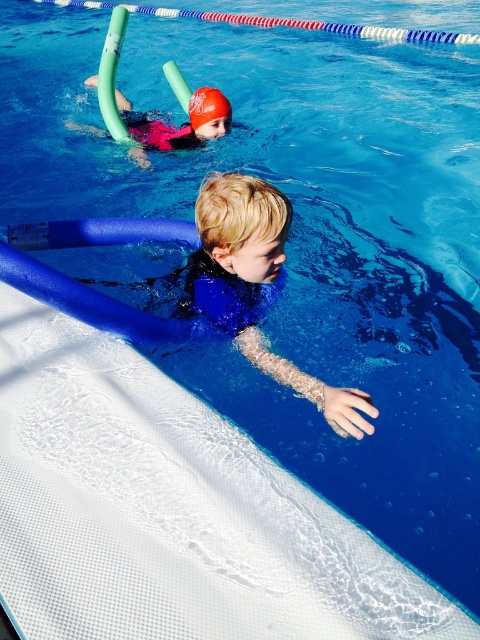
You are a lifeguard observing the pool area. You notice the blue rubber vest at lower center and the pink matte life jacket at upper center. Which one is nearer to you?

The blue rubber vest at lower center is closer to the viewer than the pink matte life jacket at upper center.

You are a lifeguard trying to locate the matte pink swim cap at upper center. According to the coordinates provided, where exactly is the matte pink swim cap positioned in the image?

The matte pink swim cap at upper center is located at point coordinates 0.198 on the x axis and 0.375 on the y axis.

You are a lifeguard standing at the edge of the pool. You notice two objects at the upper center of the pool area. The objects are the matte pink swim cap at upper center and the pink matte life jacket at upper center. Can you safely retrieve both items without getting into the water using a 2.5 inch long pool skimmer net?

The distance between the matte pink swim cap at upper center and the pink matte life jacket at upper center is 2.19 inches. Since the pool skimmer net is 2.5 inches long, you can safely retrieve both items without getting into the water.